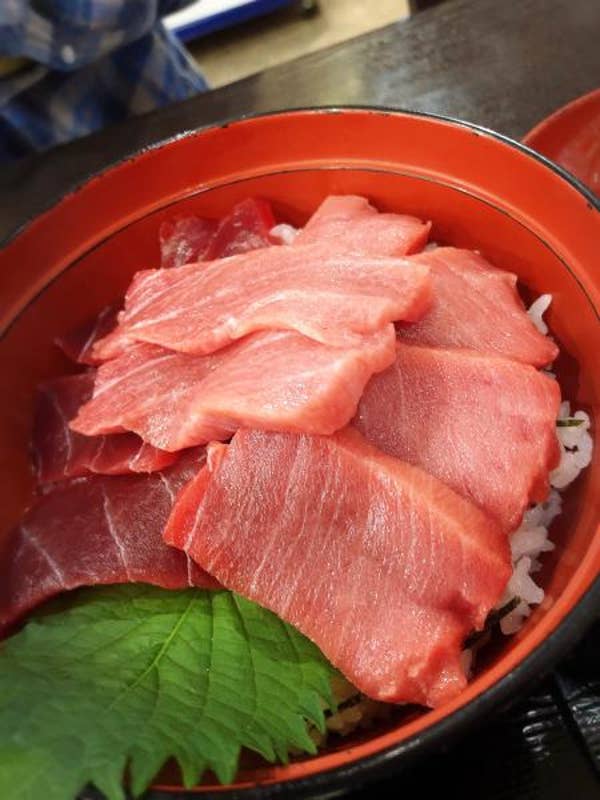
At what (x,y) coordinates should I click in order to perform the action: click on red bowl. Please return your answer as a coordinate pair (x, y). The height and width of the screenshot is (800, 600). Looking at the image, I should click on (238, 150).